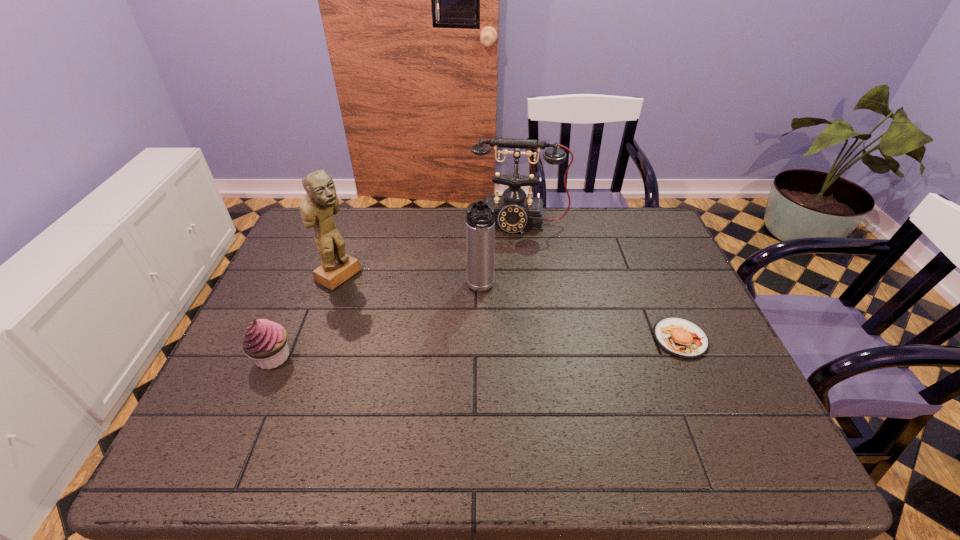
You are a GUI agent. You are given a task and a screenshot of the screen. Output one action in this format:
    pyautogui.click(x=<x>, y=<y>)
    Task: Click on the vacant spot on the desktop that is between the cupcake and the patty and is positioned on the dial of the telephone
    Image resolution: width=960 pixels, height=540 pixels.
    Given the screenshot: What is the action you would take?
    pyautogui.click(x=510, y=346)

The height and width of the screenshot is (540, 960). What are the coordinates of `vacant space on the desktop that is between the cupcake and the patty and is positioned on the front-facing side of the figurine` in the screenshot? It's located at (478, 348).

Find the location of a particular element. This screenshot has width=960, height=540. vacant space on the desktop that is between the cupcake and the rightmost object and is positioned on the handle side of the thermos bottle is located at coordinates pyautogui.click(x=485, y=347).